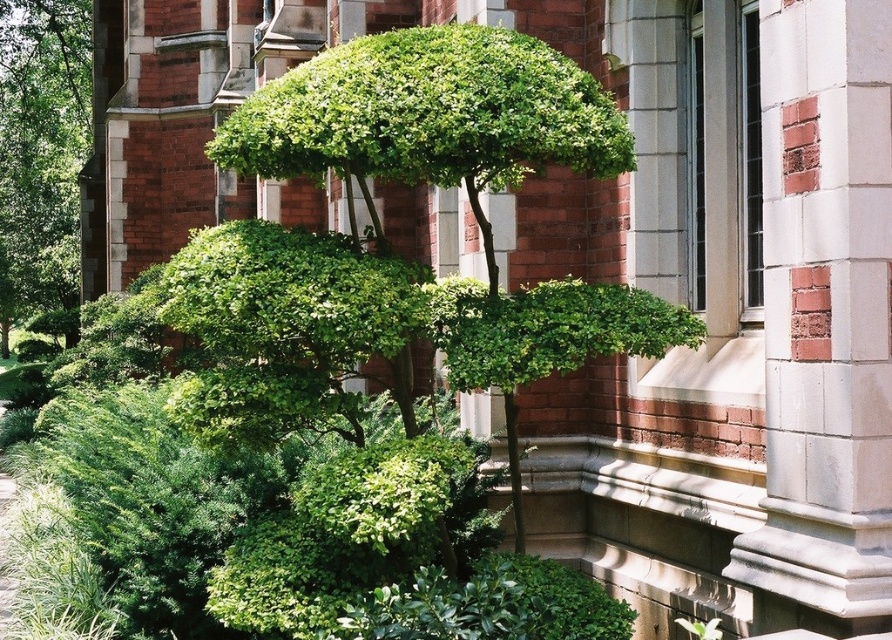
Question: Can you confirm if green leafy bush at center is thinner than green leafy bush at left?

Choices:
 (A) no
 (B) yes

Answer: (B)

Question: Which point is closer to the camera taking this photo?

Choices:
 (A) (348, 326)
 (B) (62, 147)

Answer: (A)

Question: Can you confirm if green leafy bush at center is positioned above green leafy bush at left?

Choices:
 (A) no
 (B) yes

Answer: (A)

Question: Which point is farther from the camera taking this photo?

Choices:
 (A) (282, 436)
 (B) (68, 1)

Answer: (B)

Question: Considering the relative positions of green leafy bush at center and green leafy bush at left in the image provided, where is green leafy bush at center located with respect to green leafy bush at left?

Choices:
 (A) left
 (B) right

Answer: (B)

Question: Which point is closer to the camera?

Choices:
 (A) (81, 100)
 (B) (194, 291)

Answer: (B)